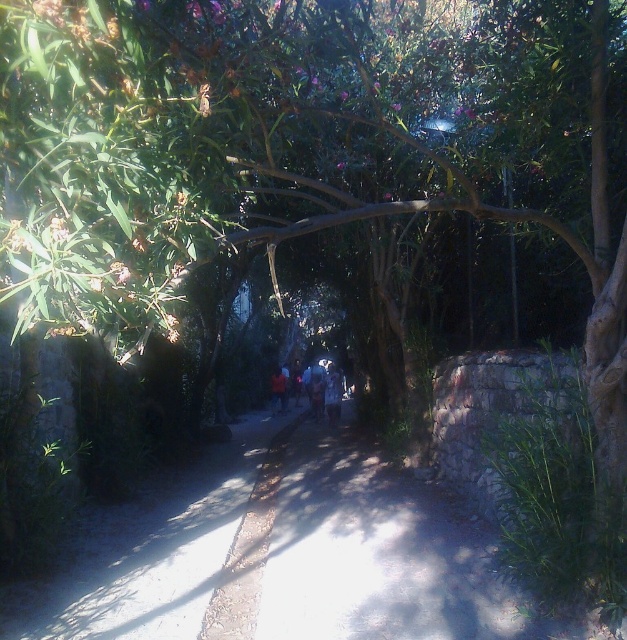
Does matte blue shirt at center have a smaller size compared to orange fabric at center?

Incorrect, matte blue shirt at center is not smaller in size than orange fabric at center.

Is point (322, 374) more distant than point (278, 387)?

That is False.

Locate an element on the screen. matte blue shirt at center is located at coordinates (324, 388).

Does matte blue shirt at center appear on the right side of blue denim jeans at center?

In fact, matte blue shirt at center is to the left of blue denim jeans at center.

Is point (335, 371) farther from camera compared to point (334, 394)?

Yes, it is.

Is point (317, 401) closer to camera compared to point (335, 408)?

No, it is behind (335, 408).

Image resolution: width=627 pixels, height=640 pixels. Identify the location of matte blue shirt at center. (324, 388).

Who is lower down, dirt path at center or orange fabric at center?

dirt path at center is below.

Who is more distant from viewer, (529, 616) or (282, 394)?

The point (282, 394) is behind.

Which is behind, point (334, 572) or point (277, 397)?

The point (277, 397) is more distant.

I want to click on dirt path at center, so click(287, 556).